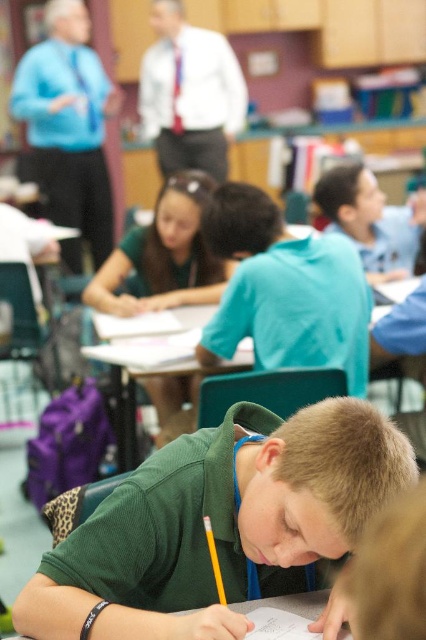
Between point (166, 636) and point (420, 371), which one is positioned in front?

Positioned in front is point (166, 636).

Image resolution: width=426 pixels, height=640 pixels. What are the coordinates of `green matte shirt at center` in the screenshot? It's located at (219, 524).

Where is `green matte shirt at center`? This screenshot has width=426, height=640. green matte shirt at center is located at coordinates (219, 524).

The width and height of the screenshot is (426, 640). What do you see at coordinates (219, 524) in the screenshot?
I see `green matte shirt at center` at bounding box center [219, 524].

Between green matte shirt at center and white paper at lower center, which one is positioned higher?

green matte shirt at center

Describe the element at coordinates (219, 524) in the screenshot. I see `green matte shirt at center` at that location.

Where is `green matte shirt at center`? This screenshot has width=426, height=640. green matte shirt at center is located at coordinates (219, 524).

Is point (379, 328) closer to viewer compared to point (313, 596)?

No, it is behind (313, 596).

What do you see at coordinates (400, 333) in the screenshot? I see `wooden desk at center` at bounding box center [400, 333].

Image resolution: width=426 pixels, height=640 pixels. Find the location of `wooden desk at center`. wooden desk at center is located at coordinates (400, 333).

Identify the location of wooden desk at center. (400, 333).